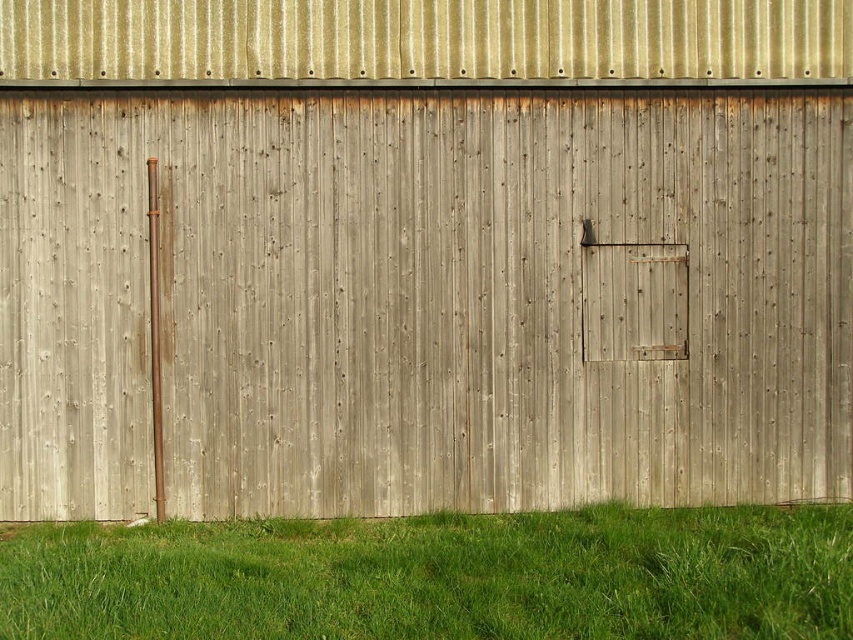
Between point (828, 426) and point (746, 614), which one is positioned in front?

Point (746, 614) is in front.

Is weathered wood door at center smaller than green grass at lower center?

Yes, weathered wood door at center is smaller than green grass at lower center.

Describe the element at coordinates (421, 300) in the screenshot. The height and width of the screenshot is (640, 853). I see `weathered wood door at center` at that location.

Locate an element on the screen. weathered wood door at center is located at coordinates (421, 300).